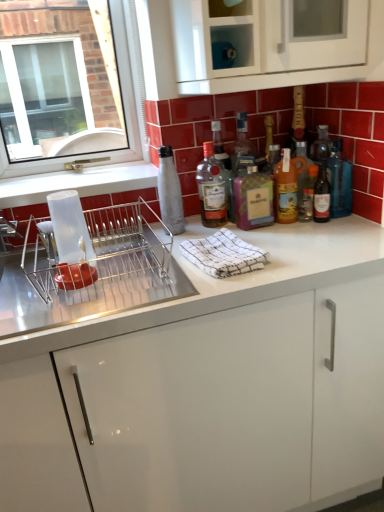
You are a GUI agent. You are given a task and a screenshot of the screen. Output one action in this format:
    pyautogui.click(x=<x>, y=<y>)
    Task: Click on the vacant area to the left of matte glass bottle at center, the 2th bottle positioned from the left
    
    Given the screenshot: What is the action you would take?
    pyautogui.click(x=158, y=230)